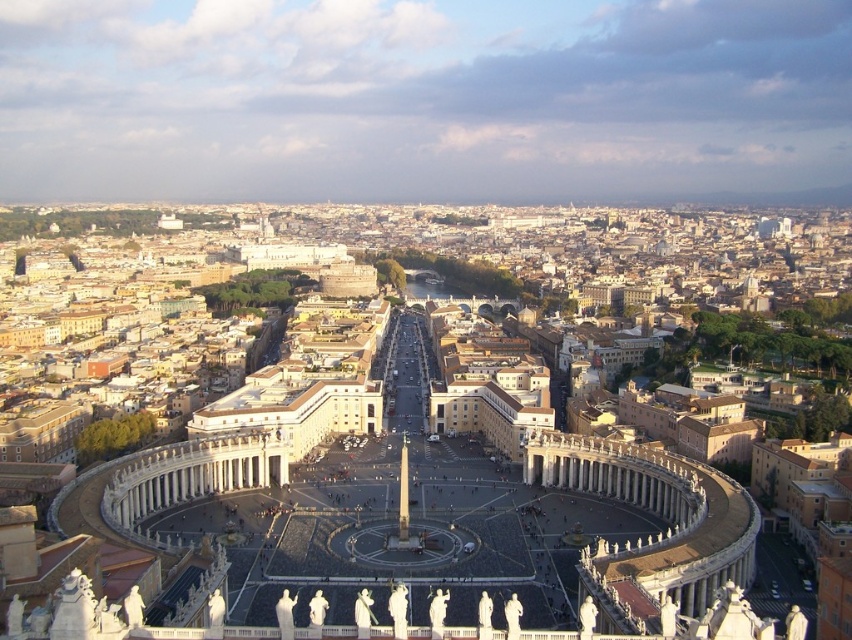
Question: Does white marble palace at center appear on the right side of white marble pillar at center?

Choices:
 (A) yes
 (B) no

Answer: (B)

Question: Observing the image, what is the correct spatial positioning of white marble palace at center in reference to white marble pillar at center?

Choices:
 (A) left
 (B) right

Answer: (A)

Question: Does white marble palace at center have a greater width compared to white marble pillar at center?

Choices:
 (A) no
 (B) yes

Answer: (B)

Question: Which point is closer to the camera?

Choices:
 (A) click(404, 508)
 (B) click(470, 216)

Answer: (A)

Question: Which object is closer to the camera taking this photo?

Choices:
 (A) white marble pillar at center
 (B) white marble palace at center

Answer: (B)